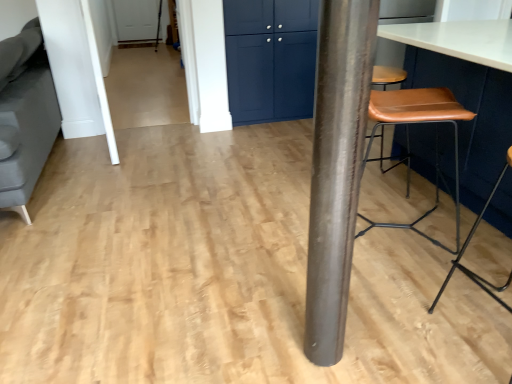
Identify the location of free location in front of brown leather stool at right. The image size is (512, 384). (408, 287).